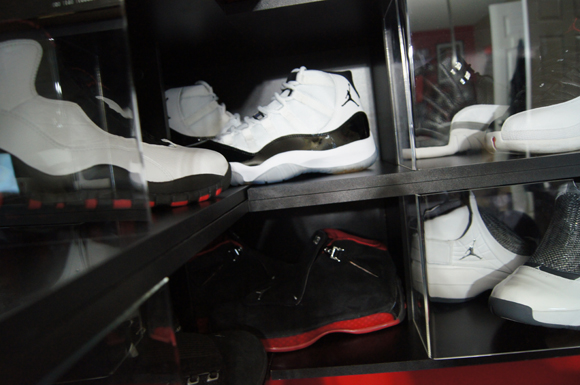
The width and height of the screenshot is (580, 385). What are the coordinates of `black shefl` in the screenshot? It's located at (346, 184), (115, 277).